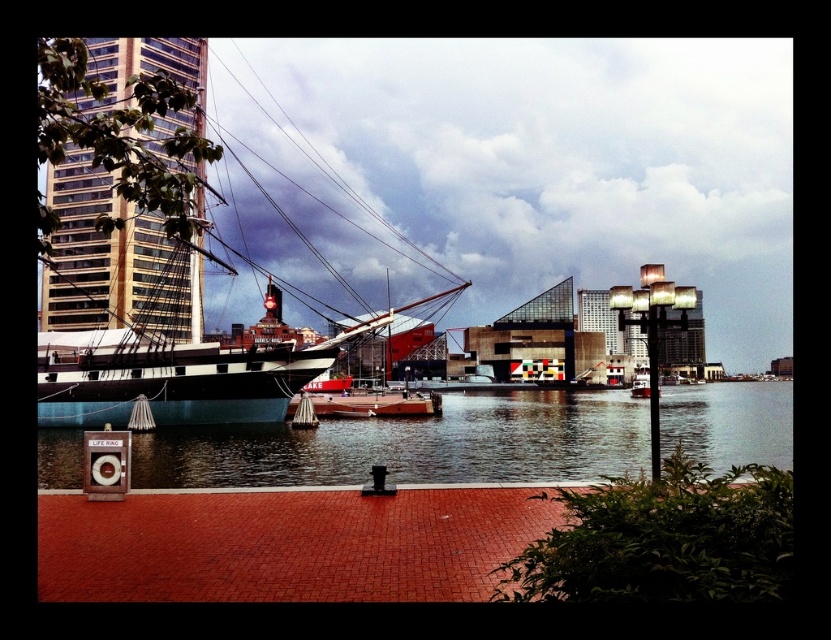
Question: Which point is farther to the camera?

Choices:
 (A) (406, 433)
 (B) (150, 225)
 (C) (406, 548)

Answer: (B)

Question: Can you confirm if brick at lower center is positioned to the right of clear water at center?

Choices:
 (A) no
 (B) yes

Answer: (A)

Question: Can you confirm if black polished wood ship at left is wider than brick at lower center?

Choices:
 (A) no
 (B) yes

Answer: (B)

Question: Among these points, which one is farthest from the camera?

Choices:
 (A) (414, 512)
 (B) (165, 438)

Answer: (B)

Question: Which point appears closest to the camera in this image?

Choices:
 (A) (195, 209)
 (B) (58, 518)
 (C) (684, 429)

Answer: (B)

Question: Is black polished wood ship at left closer to the viewer compared to clear water at center?

Choices:
 (A) yes
 (B) no

Answer: (A)